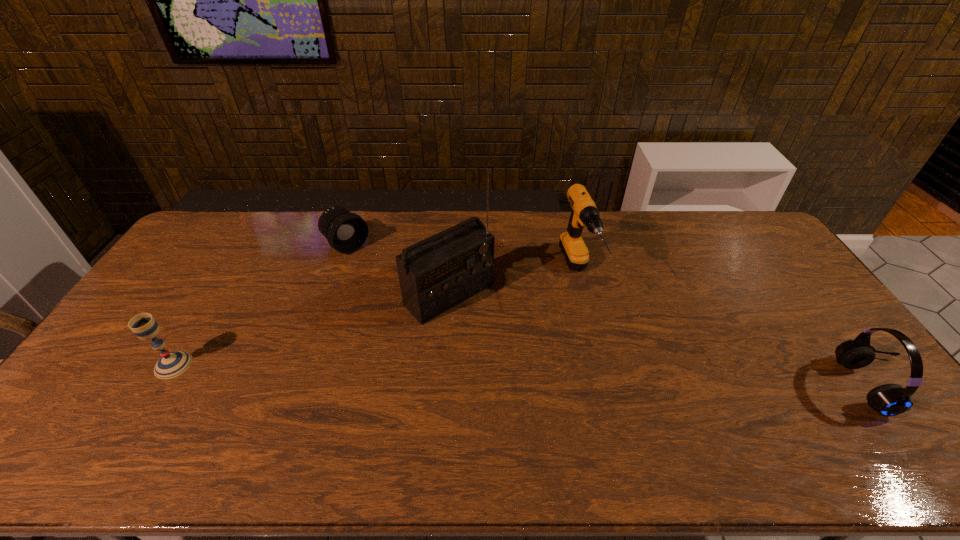
This screenshot has width=960, height=540. In order to click on chalice in this screenshot , I will do `click(172, 364)`.

Identify the location of headset. The width and height of the screenshot is (960, 540). (888, 400).

I want to click on the third object from right to left, so click(436, 274).

Locate an element on the screen. This screenshot has width=960, height=540. radio receiver is located at coordinates (436, 274).

The width and height of the screenshot is (960, 540). In order to click on the second object from left to right in this screenshot , I will do `click(346, 232)`.

In order to click on telephoto lens in this screenshot , I will do `click(346, 232)`.

At what (x,y) coordinates should I click in order to perform the action: click on the fourth shortest object. Please return your answer as a coordinate pair (x, y). The width and height of the screenshot is (960, 540). Looking at the image, I should click on [x=584, y=213].

Where is `the second object from right to left`? The image size is (960, 540). the second object from right to left is located at coordinates (584, 213).

Where is `free space located on the back of the chalice`? free space located on the back of the chalice is located at coordinates (223, 285).

Where is `vacant space located on the front panel of the third object from right to left`? The width and height of the screenshot is (960, 540). vacant space located on the front panel of the third object from right to left is located at coordinates (559, 395).